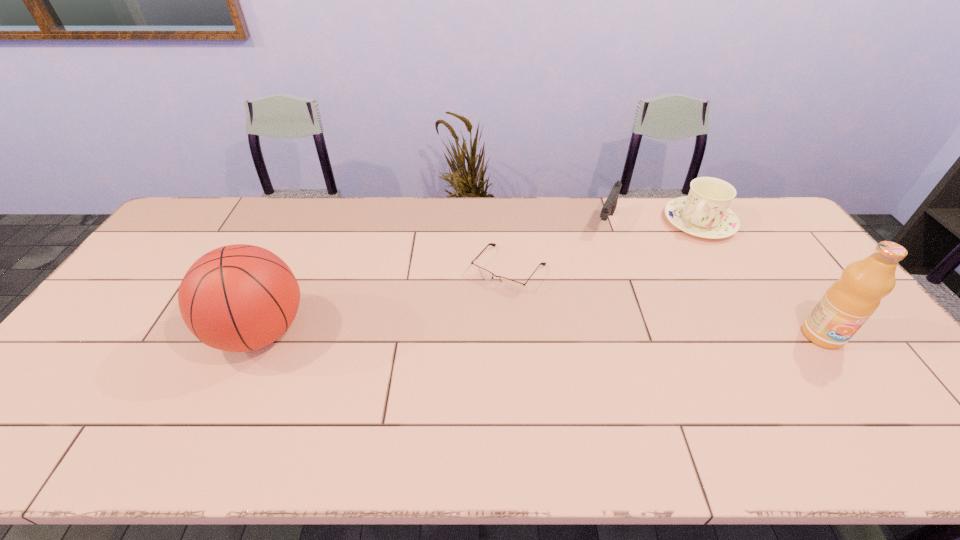
Where is `vacant space on the desktop that is between the basketball and the fruit juice and is positioned at the barrel of the third object from right to left`? This screenshot has width=960, height=540. vacant space on the desktop that is between the basketball and the fruit juice and is positioned at the barrel of the third object from right to left is located at coordinates (552, 334).

Locate an element on the screen. The height and width of the screenshot is (540, 960). vacant spot on the desktop that is between the basketball and the fruit juice and is positioned on the handle side of the chinaware is located at coordinates (610, 334).

The height and width of the screenshot is (540, 960). What are the coordinates of `vacant space on the desktop that is between the basketball and the fruit juice and is positioned on the front-facing side of the third nearest object` in the screenshot? It's located at (457, 333).